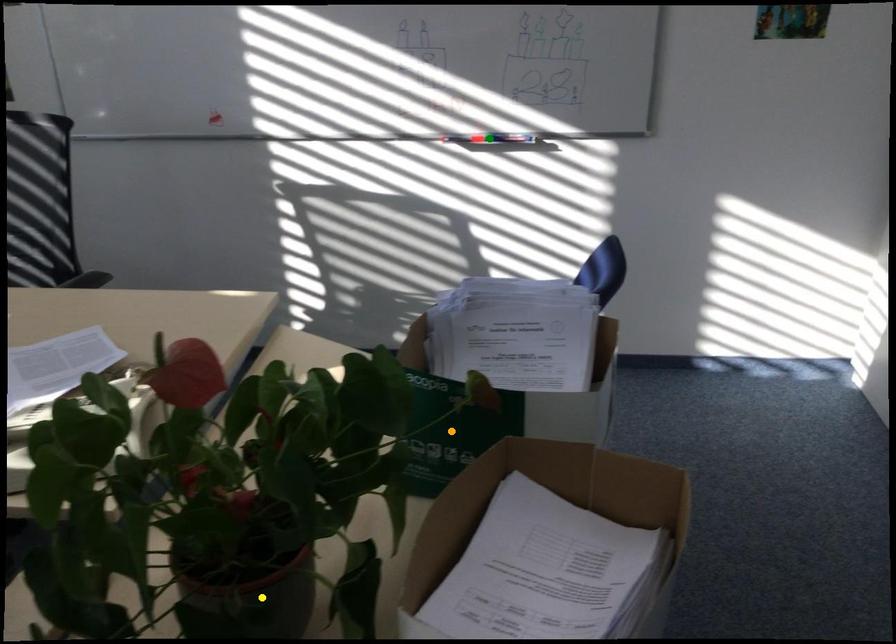
Order these from nearest to farthest:
green point | yellow point | orange point

green point < orange point < yellow point